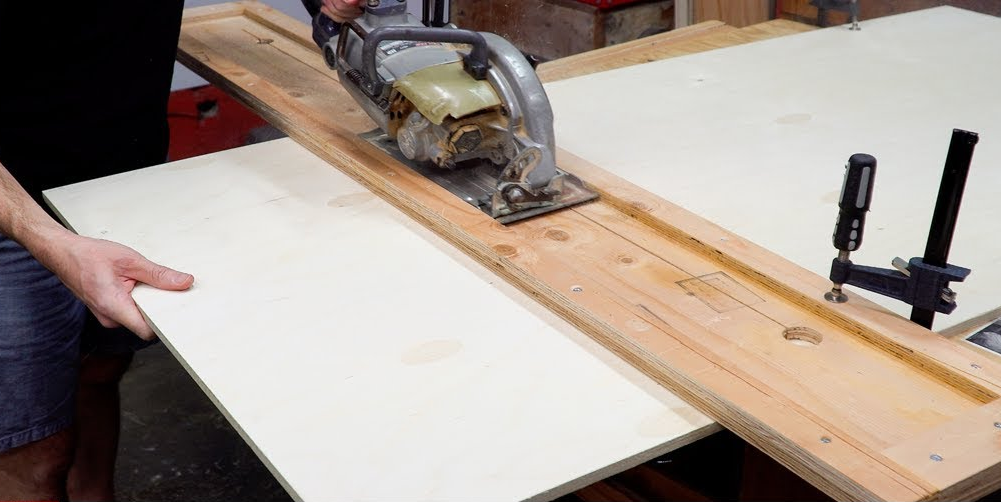
The image size is (1001, 502). What are the coordinates of `white board` in the screenshot? It's located at (382, 350).